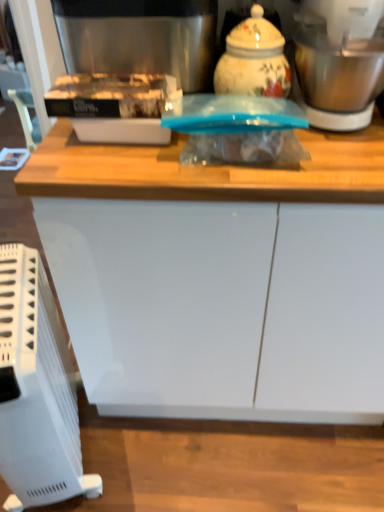
Question: From a real-world perspective, is white plastic heater at lower left physically located above or below matte plastic container at upper left?

Choices:
 (A) above
 (B) below

Answer: (B)

Question: From their relative heights in the image, would you say white plastic heater at lower left is taller or shorter than matte plastic container at upper left?

Choices:
 (A) tall
 (B) short

Answer: (A)

Question: Considering the real-world distances, which object is farthest from the decorative ceramic jar at upper center?

Choices:
 (A) stainless steel blender at upper right
 (B) white glossy cabinet at center
 (C) stainless steel coffee machine at upper center
 (D) matte plastic container at upper left
 (E) white plastic heater at lower left

Answer: (E)

Question: Which object is the closest to the white plastic heater at lower left?

Choices:
 (A) white glossy cabinet at center
 (B) stainless steel blender at upper right
 (C) matte plastic container at upper left
 (D) stainless steel coffee machine at upper center
 (E) decorative ceramic jar at upper center

Answer: (A)